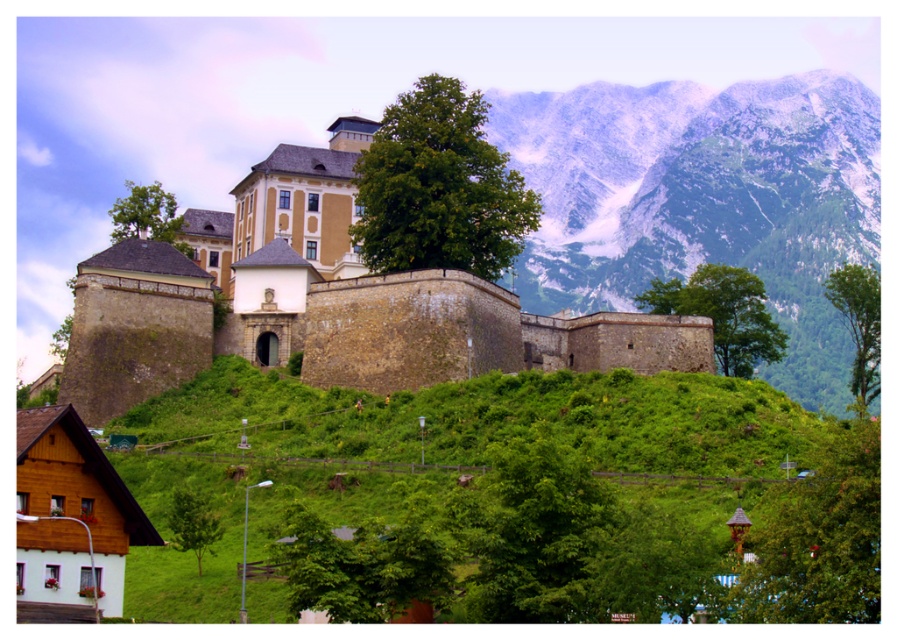
Question: Considering the real-world distances, which object is closest to the green leafy tree at upper center?

Choices:
 (A) yellow stone castle at center
 (B) green leafy tree at lower left
 (C) green leafy tree at center

Answer: (A)

Question: Which point appears closest to the camera in this image?

Choices:
 (A) (469, 198)
 (B) (176, 225)
 (C) (212, 538)
 (D) (861, 516)

Answer: (D)

Question: Does green leafy tree at upper right appear on the left side of green leafy tree at right?

Choices:
 (A) yes
 (B) no

Answer: (A)

Question: Among these objects, which one is nearest to the camera?

Choices:
 (A) green leafy tree at right
 (B) green leafy tree at upper right
 (C) green leafy tree at upper center
 (D) green leafy tree at center

Answer: (A)

Question: Is yellow stone castle at center positioned before green leafy tree at upper center?

Choices:
 (A) no
 (B) yes

Answer: (B)

Question: Does green leafy tree at right have a greater width compared to green leafy tree at upper center?

Choices:
 (A) yes
 (B) no

Answer: (B)